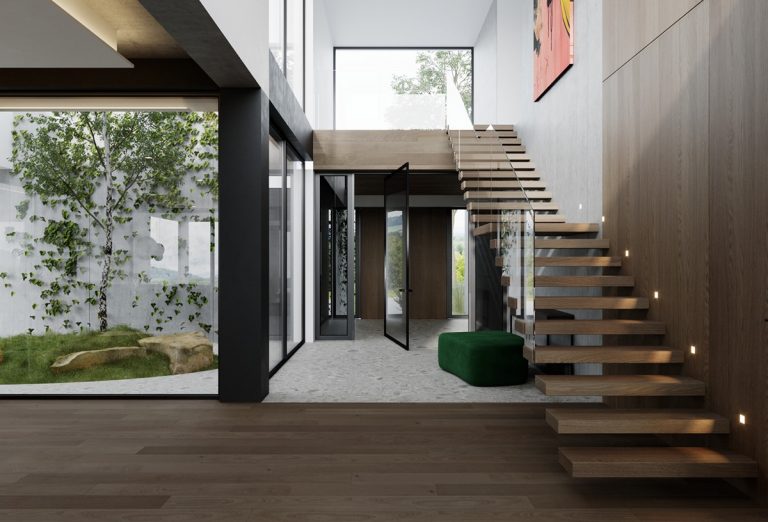
Where is `lights to guide people on stairs`? lights to guide people on stairs is located at coordinates (740, 419), (692, 350), (656, 294).